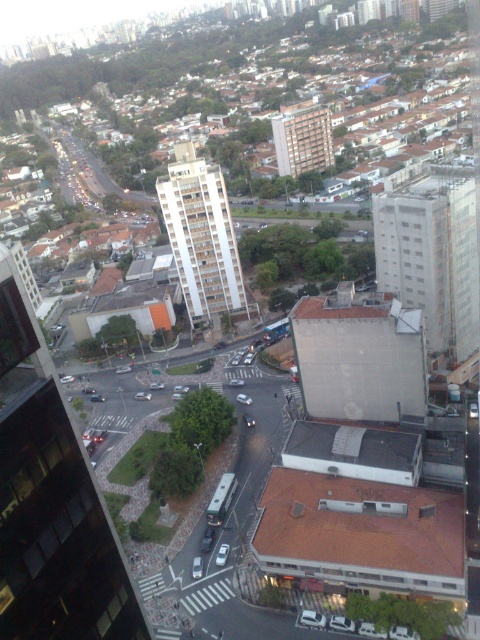
Question: Does white concrete building at center lie in front of brown brick building at center?

Choices:
 (A) yes
 (B) no

Answer: (A)

Question: Considering the real-world distances, which object is closest to the white concrete building at center?

Choices:
 (A) white smooth building at center
 (B) brown brick building at center

Answer: (A)

Question: Can you confirm if white smooth building at center is smaller than brown brick building at center?

Choices:
 (A) no
 (B) yes

Answer: (B)

Question: Which of the following is the farthest from the observer?

Choices:
 (A) (441, 298)
 (B) (183, 220)

Answer: (B)

Question: Can you confirm if white concrete building at center is smaller than white smooth building at center?

Choices:
 (A) no
 (B) yes

Answer: (A)

Question: Which point is farther to the camera?

Choices:
 (A) white concrete building at center
 (B) white smooth building at center

Answer: (B)